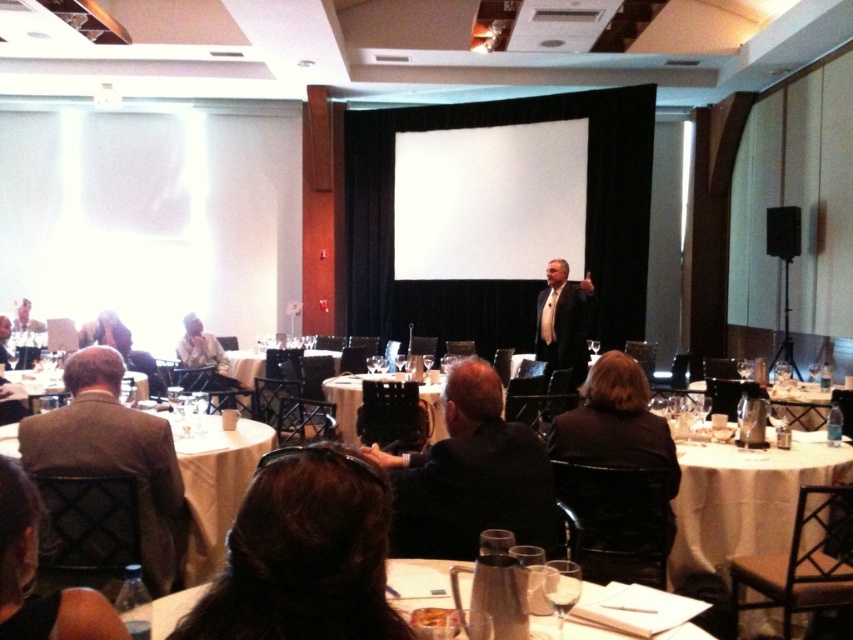
Question: Which of these objects is positioned closest to the white paper at center?

Choices:
 (A) brown hair at center
 (B) black matte speaker at upper right

Answer: (A)

Question: Is white matte projection screen at center bigger than white tablecloth at lower left?

Choices:
 (A) no
 (B) yes

Answer: (B)

Question: Observing the image, what is the correct spatial positioning of clear glass wine glass at lower center in reference to white glossy table at center?

Choices:
 (A) right
 (B) left

Answer: (A)

Question: Among these points, which one is farthest from the camera?

Choices:
 (A) (32, 397)
 (B) (560, 595)
 (C) (256, 365)

Answer: (C)

Question: Which point is farther from the camera taking this photo?

Choices:
 (A) (117, 456)
 (B) (341, 497)

Answer: (A)

Question: Is brown wool suit at left wider than white glossy table at center?

Choices:
 (A) yes
 (B) no

Answer: (B)